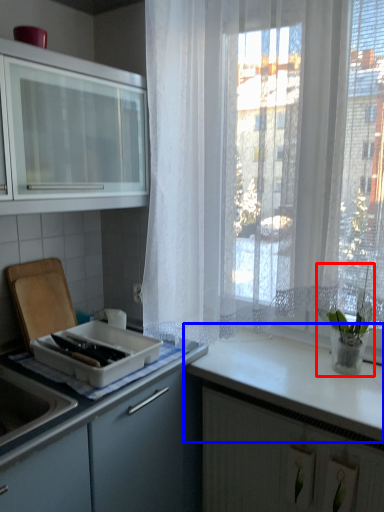
Question: Among these objects, which one is nearest to the camera, houseplant (highlighted by a red box) or countertop (highlighted by a blue box)?

Choices:
 (A) houseplant
 (B) countertop

Answer: (B)